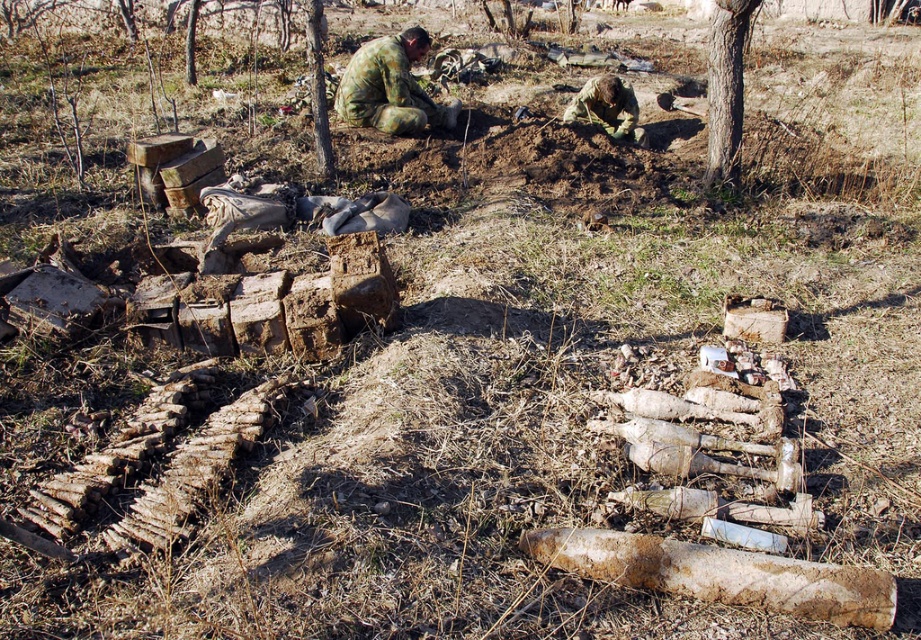
Question: Which of the following is the closest to the observer?

Choices:
 (A) brown rough log at lower right
 (B) camouflage fabric uniform at center

Answer: (A)

Question: Which object is positioned farthest from the brown rough log at lower right?

Choices:
 (A) camouflage fabric uniform at center
 (B) camouflage fabric soldier at center
 (C) brown rough bark tree at upper right

Answer: (B)

Question: Observing the image, what is the correct spatial positioning of brown rough log at lower right in reference to brown bark tree at center?

Choices:
 (A) left
 (B) right

Answer: (B)

Question: Which of the following is the closest to the observer?

Choices:
 (A) (584, 97)
 (B) (895, 604)
 (C) (450, 106)
 (D) (309, 33)

Answer: (B)

Question: Does camouflage fabric uniform at center have a lesser width compared to brown rough bark tree at upper right?

Choices:
 (A) no
 (B) yes

Answer: (A)

Question: Is brown rough log at lower right below brown bark tree at center?

Choices:
 (A) yes
 (B) no

Answer: (A)